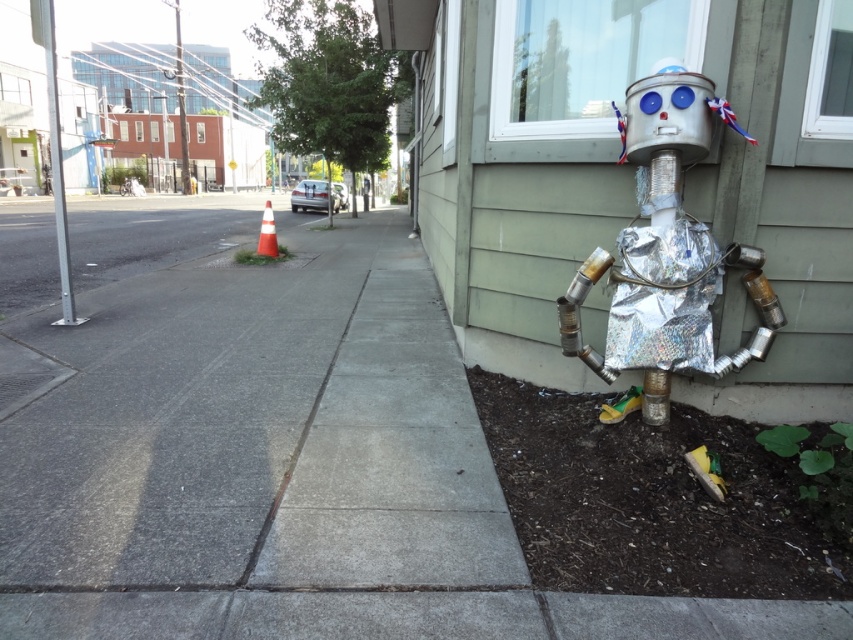
Question: Estimate the real-world distances between objects in this image. Which object is farther from the gray concrete sidewalk at center?

Choices:
 (A) dark brown soil at lower right
 (B) holographic foil robot at lower right

Answer: (B)

Question: Which object is closer to the camera taking this photo?

Choices:
 (A) dark brown soil at lower right
 (B) holographic foil robot at lower right
 (C) gray concrete sidewalk at center

Answer: (C)

Question: Can you confirm if gray concrete sidewalk at center is positioned to the left of dark brown soil at lower right?

Choices:
 (A) no
 (B) yes

Answer: (B)

Question: Is gray concrete sidewalk at center above holographic foil robot at lower right?

Choices:
 (A) yes
 (B) no

Answer: (A)

Question: Which point is farther from the camera taking this photo?

Choices:
 (A) (654, 104)
 (B) (181, 308)

Answer: (B)

Question: Can you confirm if dark brown soil at lower right is positioned to the right of holographic foil robot at lower right?

Choices:
 (A) no
 (B) yes

Answer: (A)